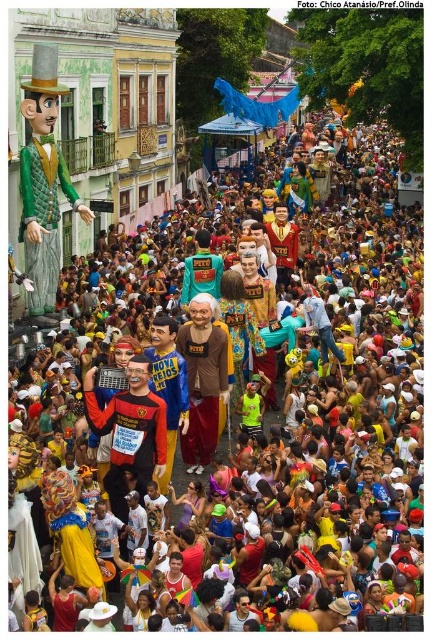
Question: Can you confirm if green quilted fabric at left is positioned to the left of brown matte shirt at center?

Choices:
 (A) yes
 (B) no

Answer: (A)

Question: Which point is closer to the camera taking this photo?

Choices:
 (A) (219, 369)
 (B) (73, 202)

Answer: (A)

Question: Does green quilted fabric at left appear under brown matte shirt at center?

Choices:
 (A) yes
 (B) no

Answer: (B)

Question: Is green quilted fabric at left positioned at the back of brown matte shirt at center?

Choices:
 (A) yes
 (B) no

Answer: (A)